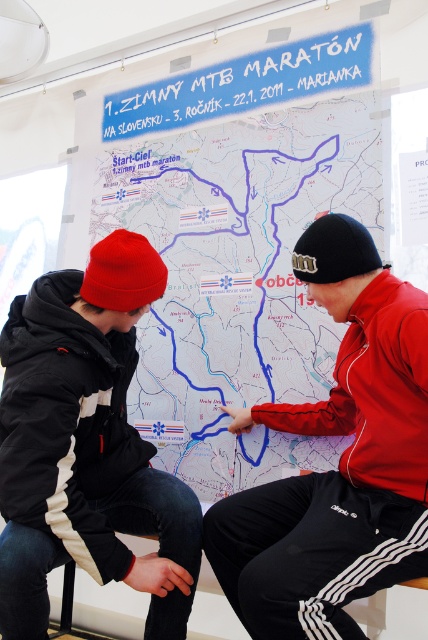
In the scene shown: You are a photographer standing in the room where the two people are discussing the map. You need to take a photo that includes both the matte paper map at center and the black matte jacket at left without any distortion. Given the camera you have can capture a maximum width of 22 inches, will you be able to fit both objects in the frame?

The distance between the matte paper map at center and the black matte jacket at left is 22.38 inches. Since the camera can only capture up to 22 inches, the total width required exceeds the camera capability by 0.38 inches. Therefore, you will not be able to fit both objects in the frame without distortion.

You are a photographer standing at the origin point of the coordinate system in the image. You want to take a photo of the red fleece jacket at center. What are the coordinates where you should aim your camera?

The coordinates for the red fleece jacket at center are at point (x=338, y=460). You should aim your camera at those coordinates to capture the red fleece jacket at center.

You are a photographer trying to capture a clear photo of the matte paper map at center. However, the red fleece jacket at center is blocking your view. Can you move the jacket to take the photo?

The red fleece jacket at center is behind the matte paper map at center, so you don not need to move the jacket to take the photo because it is already behind the map and not obstructing the view.